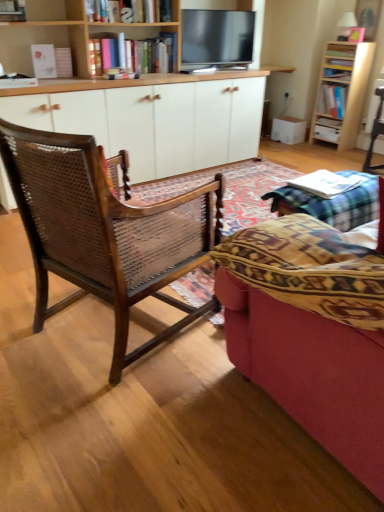
Question: Is wooden table at lower right to the left of white glossy drawer at center from the viewer's perspective?

Choices:
 (A) yes
 (B) no

Answer: (A)

Question: Would you consider wooden table at lower right to be distant from white glossy drawer at center?

Choices:
 (A) yes
 (B) no

Answer: (A)

Question: Is wooden table at lower right not inside white glossy drawer at center?

Choices:
 (A) no
 (B) yes

Answer: (B)

Question: From a real-world perspective, does wooden table at lower right sit lower than white glossy drawer at center?

Choices:
 (A) yes
 (B) no

Answer: (B)

Question: From a real-world perspective, is wooden table at lower right positioned over white glossy drawer at center based on gravity?

Choices:
 (A) yes
 (B) no

Answer: (A)

Question: Is wooden table at lower right bigger than white glossy drawer at center?

Choices:
 (A) yes
 (B) no

Answer: (A)

Question: Is wooden bookshelf at upper center, the second bookcase positioned from the back, oriented away from white wood cabinet at center?

Choices:
 (A) yes
 (B) no

Answer: (B)

Question: Considering the relative sizes of wooden bookshelf at upper center, which is the first bookcase from front to back, and white wood cabinet at center in the image provided, is wooden bookshelf at upper center, which is the first bookcase from front to back, wider than white wood cabinet at center?

Choices:
 (A) yes
 (B) no

Answer: (B)

Question: From the image's perspective, is wooden bookshelf at upper center, the second bookcase positioned from the back, located above white wood cabinet at center?

Choices:
 (A) yes
 (B) no

Answer: (A)

Question: Does wooden bookshelf at upper center, which appears as the second bookcase when viewed from the right, have a lesser width compared to white wood cabinet at center?

Choices:
 (A) no
 (B) yes

Answer: (B)

Question: Is wooden bookshelf at upper center, which is the first bookcase from front to back, located outside white wood cabinet at center?

Choices:
 (A) yes
 (B) no

Answer: (A)

Question: Does wooden bookshelf at upper center, which is the 1th bookcase in left-to-right order, have a greater height compared to white wood cabinet at center?

Choices:
 (A) yes
 (B) no

Answer: (B)

Question: Is the position of flat screen tv at upper center less distant than that of white paper book at center, which is counted as the 3th book, starting from the back?

Choices:
 (A) no
 (B) yes

Answer: (A)